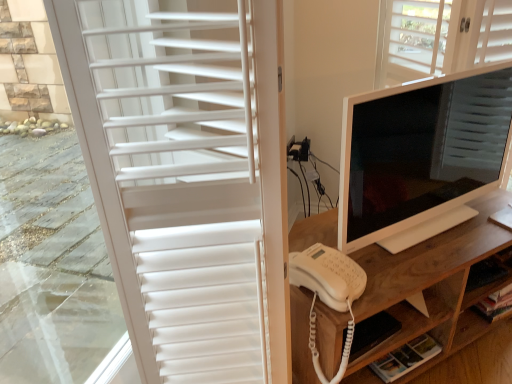
Question: Can you confirm if white matte shutter at left is positioned to the right of wooden desk at center?

Choices:
 (A) no
 (B) yes

Answer: (A)

Question: Considering the relative sizes of white matte shutter at left and wooden desk at center in the image provided, is white matte shutter at left shorter than wooden desk at center?

Choices:
 (A) yes
 (B) no

Answer: (B)

Question: Is white matte shutter at left oriented towards wooden desk at center?

Choices:
 (A) yes
 (B) no

Answer: (B)

Question: Is white matte shutter at left behind wooden desk at center?

Choices:
 (A) yes
 (B) no

Answer: (B)

Question: Is white matte shutter at left positioned beyond the bounds of wooden desk at center?

Choices:
 (A) yes
 (B) no

Answer: (A)

Question: Is white matte shutter at left smaller than wooden desk at center?

Choices:
 (A) no
 (B) yes

Answer: (B)

Question: From the image's perspective, is white matte shutter at left under white plastic telephone at center?

Choices:
 (A) yes
 (B) no

Answer: (B)

Question: Is white matte shutter at left looking in the opposite direction of white plastic telephone at center?

Choices:
 (A) yes
 (B) no

Answer: (B)

Question: Is white matte shutter at left not close to white plastic telephone at center?

Choices:
 (A) no
 (B) yes

Answer: (A)

Question: Are white matte shutter at left and white plastic telephone at center making contact?

Choices:
 (A) no
 (B) yes

Answer: (A)

Question: Is white matte shutter at left taller than white plastic telephone at center?

Choices:
 (A) yes
 (B) no

Answer: (A)

Question: Is white matte shutter at left closer to the viewer compared to white plastic telephone at center?

Choices:
 (A) no
 (B) yes

Answer: (B)

Question: Is the position of white wood shelf at lower right more distant than that of wooden desk at center?

Choices:
 (A) no
 (B) yes

Answer: (B)